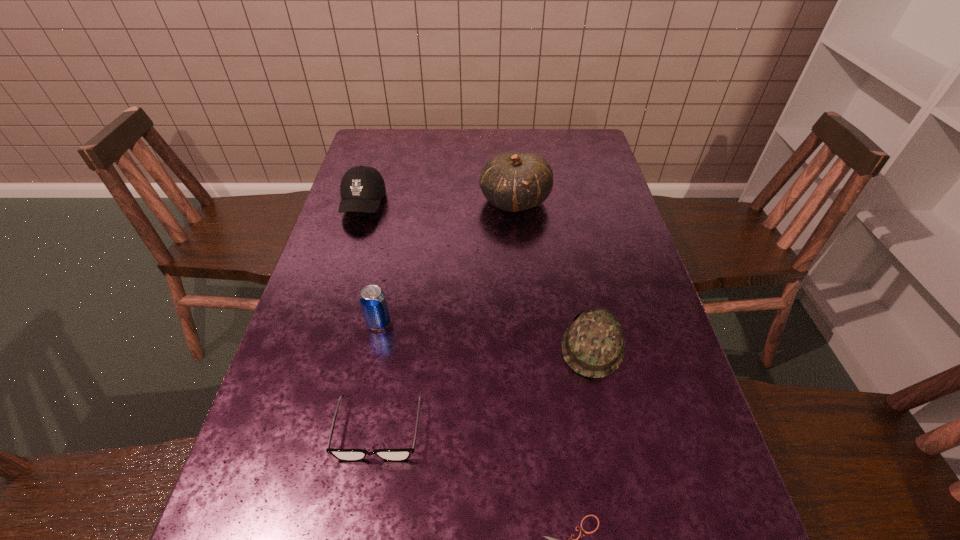
At what (x,y) coordinates should I click in order to perform the action: click on vacant area situated 0.090m on the front-facing side of the second nearest object. Please return your answer as a coordinate pair (x, y). Image resolution: width=960 pixels, height=540 pixels. Looking at the image, I should click on coord(364,517).

Identify the location of beer can present at the left edge. Image resolution: width=960 pixels, height=540 pixels. (373, 301).

Image resolution: width=960 pixels, height=540 pixels. In order to click on baseball cap that is at the left edge in this screenshot , I will do `click(362, 187)`.

This screenshot has width=960, height=540. I want to click on spectacles that is at the left edge, so (x=349, y=455).

Locate an element on the screen. The image size is (960, 540). object that is at the right edge is located at coordinates (593, 345).

In the image, there is a desktop. Where is `vacant space at the far edge`? The image size is (960, 540). vacant space at the far edge is located at coordinates (417, 144).

The image size is (960, 540). In the image, there is a desktop. Find the location of `vacant region at the left edge`. vacant region at the left edge is located at coordinates (320, 368).

At what (x,y) coordinates should I click in order to perform the action: click on vacant space at the right edge. Please return your answer as a coordinate pair (x, y). The height and width of the screenshot is (540, 960). Looking at the image, I should click on (664, 409).

Image resolution: width=960 pixels, height=540 pixels. In the image, there is a desktop. Find the location of `vacant region at the far left corner`. vacant region at the far left corner is located at coordinates (391, 145).

In the image, there is a desktop. In order to click on vacant region at the far right corner in this screenshot , I will do `click(598, 160)`.